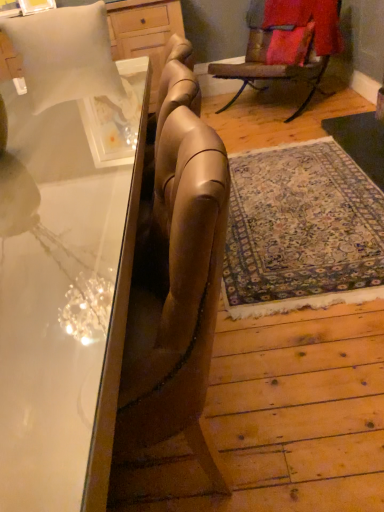
Question: From a real-world perspective, relative to velvet red pillow at upper right, positioned as the second pillow in bottom-to-top order, is wooden rocking chair at upper right vertically above or below?

Choices:
 (A) above
 (B) below

Answer: (B)

Question: Is wooden rocking chair at upper right inside or outside of velvet red pillow at upper right, which is the 2th pillow in left-to-right order?

Choices:
 (A) inside
 (B) outside

Answer: (B)

Question: Which is farther from the white matte pillow at upper left, which is the second pillow in right-to-left order?

Choices:
 (A) wooden rocking chair at upper right
 (B) clear glass desk at left
 (C) velvet red pillow at upper right, marked as the first pillow in a right-to-left arrangement

Answer: (C)

Question: Considering the real-world distances, which object is closest to the wooden rocking chair at upper right?

Choices:
 (A) white matte pillow at upper left, which is the first pillow in bottom-to-top order
 (B) velvet red pillow at upper right, positioned as the second pillow in bottom-to-top order
 (C) clear glass desk at left

Answer: (B)